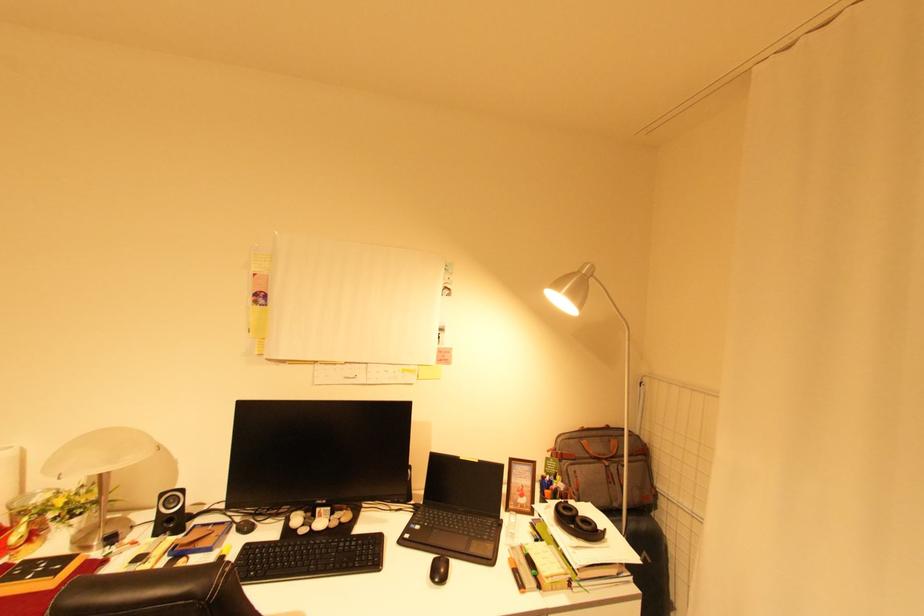
The image size is (924, 616). What do you see at coordinates (168, 522) in the screenshot?
I see `the small speaker knob` at bounding box center [168, 522].